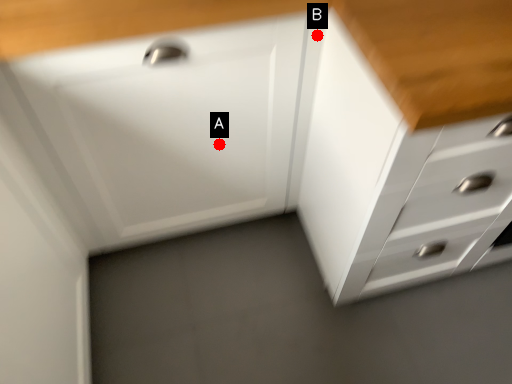
Question: Two points are circled on the image, labeled by A and B beside each circle. Which point is closer to the camera taking this photo?

Choices:
 (A) A is closer
 (B) B is closer

Answer: (B)